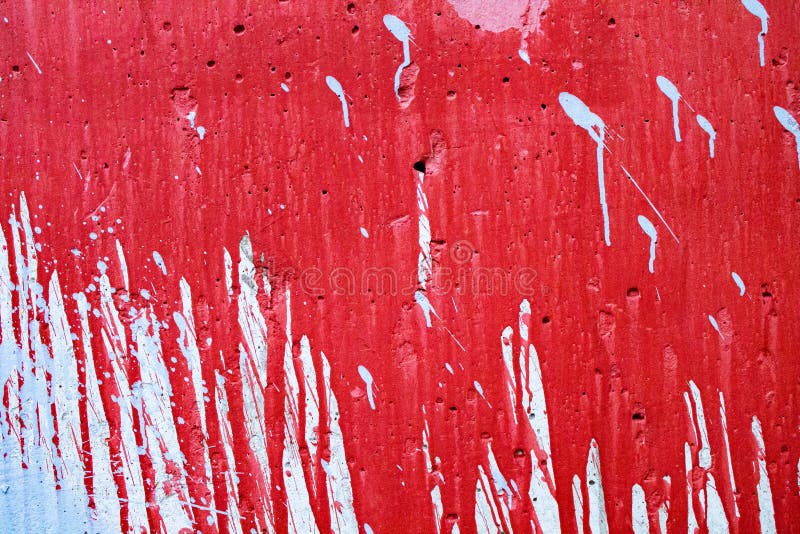
This screenshot has height=534, width=800. Find the location of `corner`. corner is located at coordinates (766, 519), (22, 522), (20, 22), (781, 20).